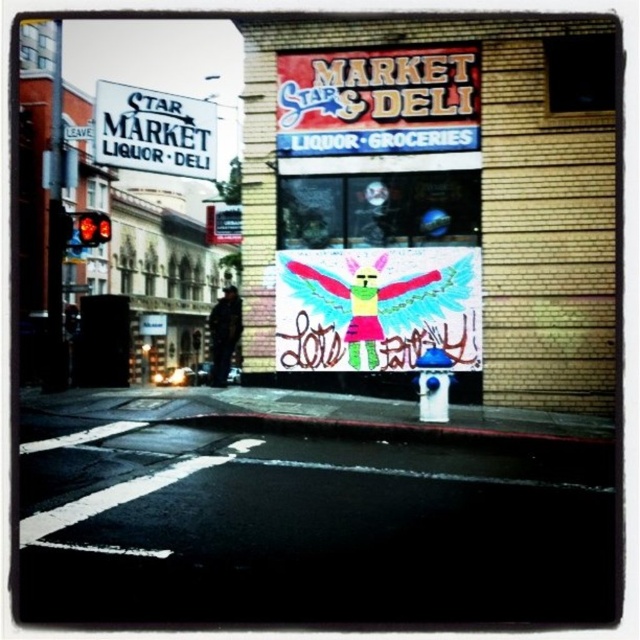
You are a customer standing in front of the Star Market store. You see a white paper sign at center and a dark blue jacket at center. Which object is located to the right of the other?

The white paper sign at center is located to the right of the dark blue jacket at center.

You are a delivery person standing at the street corner in front of the Star Market store. You need to locate the delivery drop point which is near the white plastic sign at upper left and dark blue jacket at center. Which object should you approach first if you want to reach the drop point closest to you?

The dark blue jacket at center is closer to you because the white plastic sign at upper left is positioned on the right side of dark blue jacket at center, indicating the jacket is in front of the sign.

You are a delivery person trying to read the white paper sign at center and the dark blue jacket at center from across the street. Which object is easier to see from a distance?

The white paper sign at center is thinner than the dark blue jacket at center, so the dark blue jacket at center is easier to see from a distance because it has a larger size.